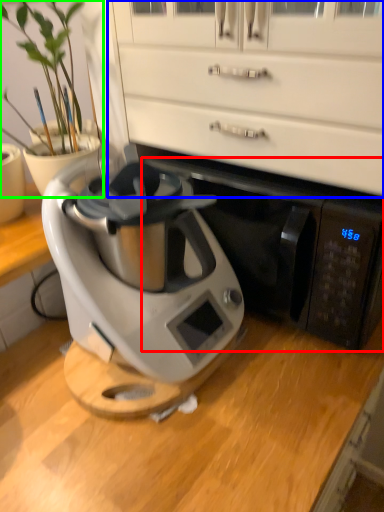
Question: Considering the real-world distances, which object is closest to wide (highlighted by a red box)? dresser (highlighted by a blue box) or houseplant (highlighted by a green box).

Choices:
 (A) dresser
 (B) houseplant

Answer: (A)